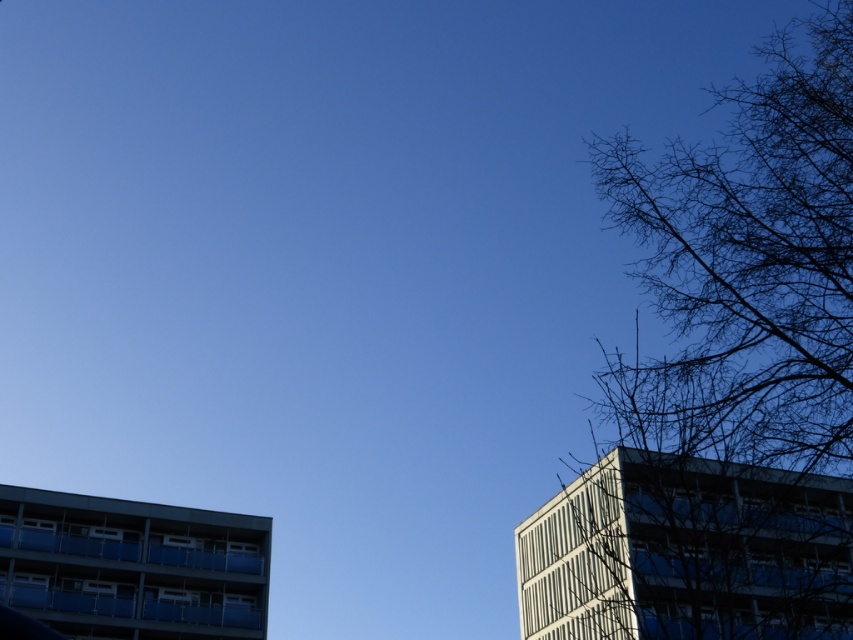
Image resolution: width=853 pixels, height=640 pixels. What do you see at coordinates (688, 552) in the screenshot?
I see `white glass building at right` at bounding box center [688, 552].

Which is behind, point (805, 538) or point (218, 595)?

Positioned behind is point (218, 595).

Which is behind, point (804, 624) or point (157, 586)?

Point (157, 586)

The width and height of the screenshot is (853, 640). Identify the location of white glass building at right. (688, 552).

Looking at this image, can you confirm if bare branches at right is bigger than white glass building at right?

Correct, bare branches at right is larger in size than white glass building at right.

Which is in front, point (669, 308) or point (642, 528)?

Point (669, 308) is more forward.

Locate an element on the screen. bare branches at right is located at coordinates (744, 344).

Is bare branches at right taller than blue glass balcony at lower left?

Yes, bare branches at right is taller than blue glass balcony at lower left.

Who is more forward, (799, 557) or (225, 540)?

Point (225, 540)

You are a GUI agent. You are given a task and a screenshot of the screen. Output one action in this format:
    pyautogui.click(x=<x>, y=<y>)
    Task: Click on the bare branches at right
    
    Given the screenshot: What is the action you would take?
    (744, 344)